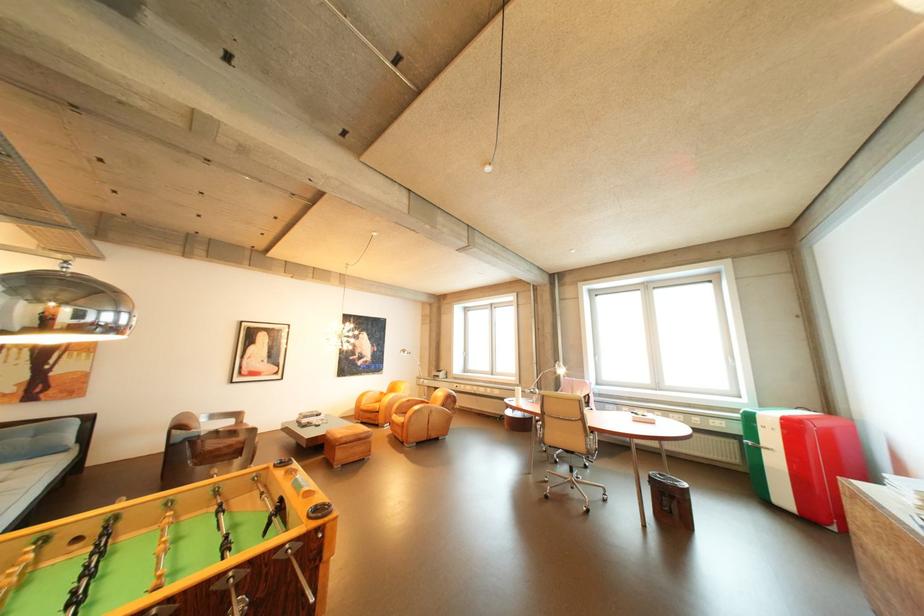
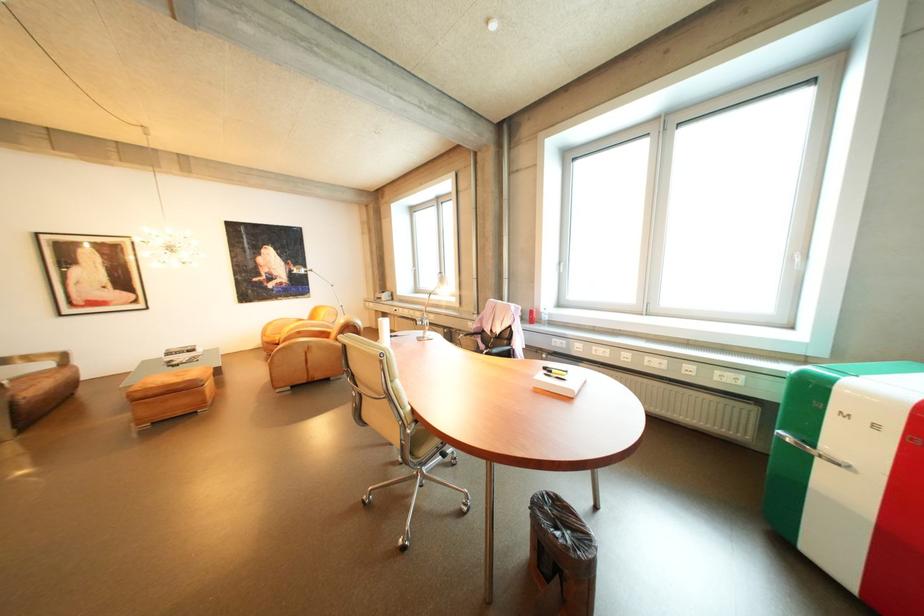
Which direction would the cameraman need to move to produce the second image?

The movement direction of the cameraman is right, forward.